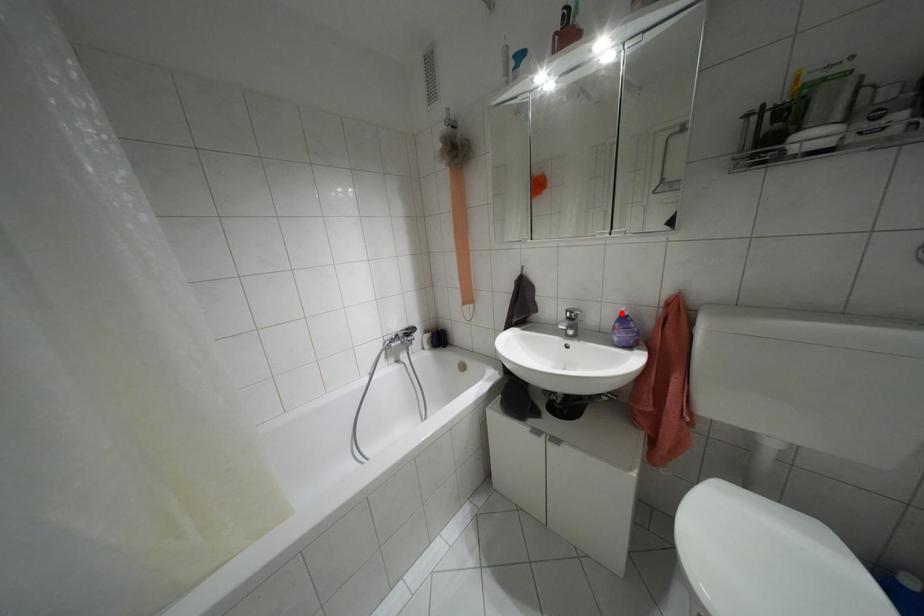
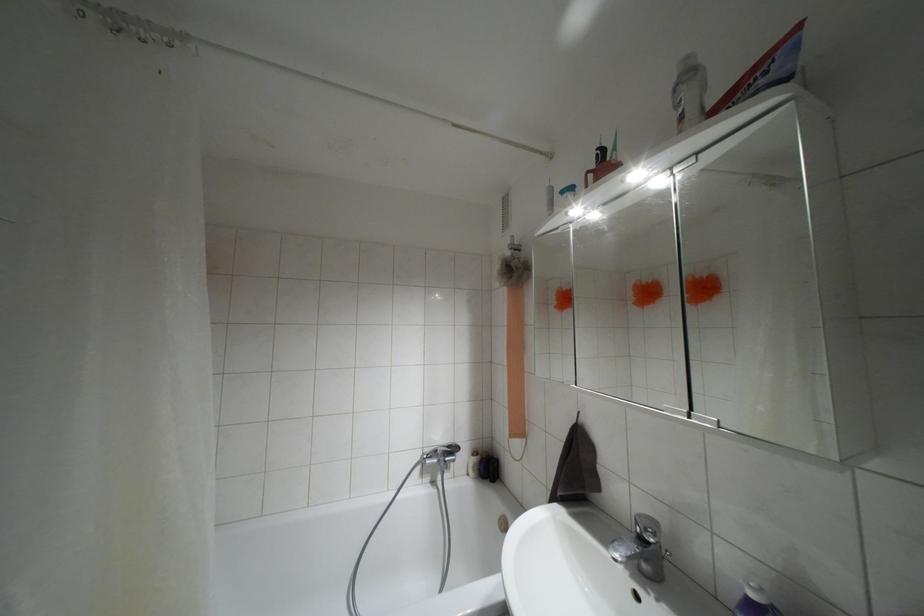
Question: I am providing you with two images of the same scene from different viewpoints. A red point is marked on the first image. At the location where the point appears in image 1, is it still visible in image 2?

Choices:
 (A) Yes
 (B) No

Answer: (A)